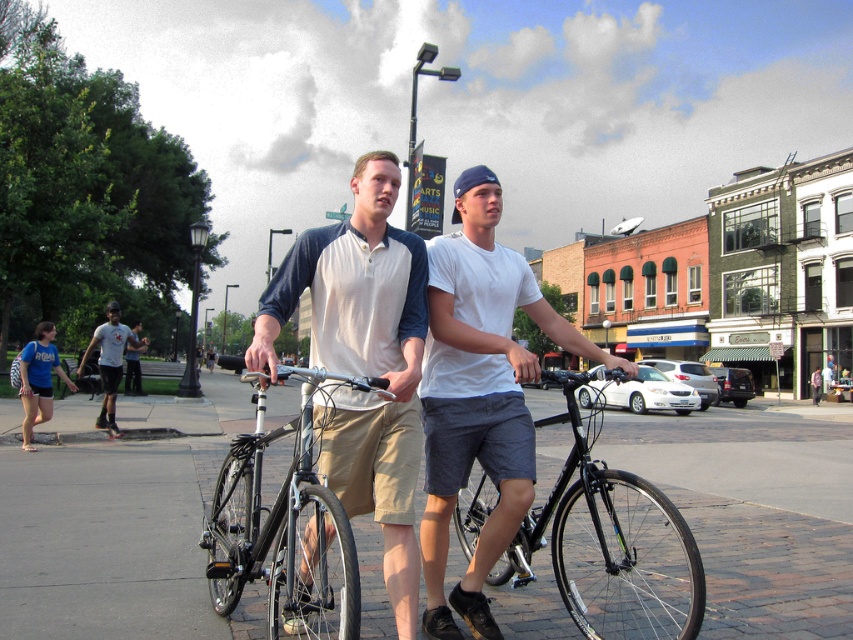
Question: Is brick pavement at center positioned in front of black matte bicycle at center?

Choices:
 (A) no
 (B) yes

Answer: (A)

Question: Can you confirm if matte white shirt at center is positioned to the right of white matte bicycle at center?

Choices:
 (A) no
 (B) yes

Answer: (A)

Question: Which of the following is the closest to the observer?

Choices:
 (A) black matte bicycle at center
 (B) brick pavement at center
 (C) silver metallic bicycle at center

Answer: (A)

Question: Based on their relative distances, which object is nearer to the white matte bicycle at center?

Choices:
 (A) white t-shirt at center
 (B) black matte bicycle at center
 (C) brick pavement at center
 (D) matte white shirt at center

Answer: (B)

Question: Which object appears closest to the camera in this image?

Choices:
 (A) matte white shirt at center
 (B) white t-shirt at center
 (C) brick pavement at center

Answer: (A)

Question: Is white matte bicycle at center closer to the viewer compared to white t-shirt at center?

Choices:
 (A) yes
 (B) no

Answer: (A)